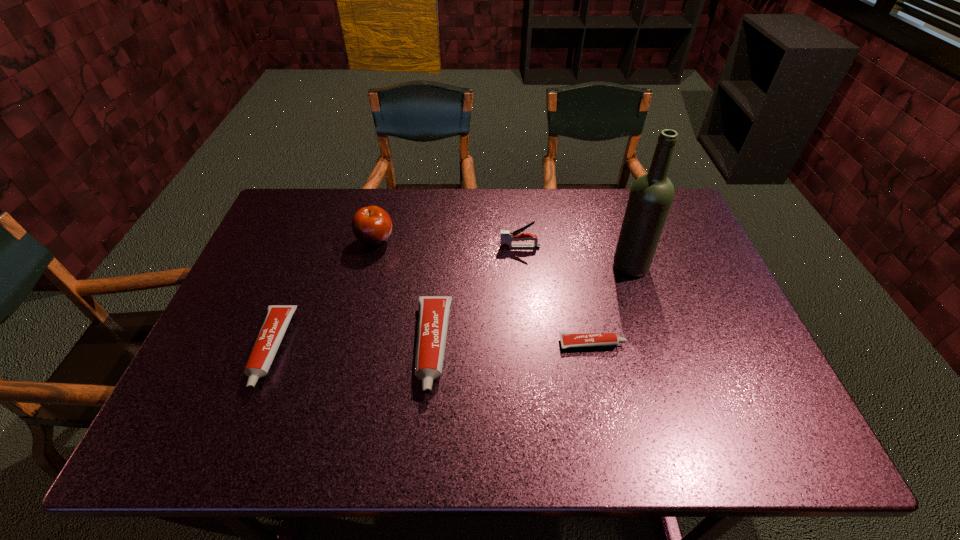
The image size is (960, 540). What are the coordinates of `free space at the far edge of the desktop` in the screenshot? It's located at (598, 212).

Where is `vacant space at the left edge of the desktop`? This screenshot has height=540, width=960. vacant space at the left edge of the desktop is located at coordinates (301, 247).

This screenshot has width=960, height=540. Find the location of `free spot at the right edge of the desktop`. free spot at the right edge of the desktop is located at coordinates (655, 259).

In the image, there is a desktop. Identify the location of vacant area at the near right corner. The height and width of the screenshot is (540, 960). (726, 376).

Where is `free space between the wine bottle and the fifth object from left to right`? This screenshot has width=960, height=540. free space between the wine bottle and the fifth object from left to right is located at coordinates (611, 305).

Where is `free space between the tallest object and the second tallest object`? This screenshot has width=960, height=540. free space between the tallest object and the second tallest object is located at coordinates (503, 254).

You are a GUI agent. You are given a task and a screenshot of the screen. Output one action in this format:
    pyautogui.click(x=<x>, y=<y>)
    Task: Click on the vacant region between the second object from left to right and the fourth shortest object
    The height and width of the screenshot is (540, 960).
    Given the screenshot: What is the action you would take?
    pyautogui.click(x=447, y=244)

You are a GUI agent. You are given a task and a screenshot of the screen. Output one action in this format:
    pyautogui.click(x=<x>, y=<y>)
    Task: Click on the vacant area that lies between the second toothpaste from left to right and the shortest object
    This screenshot has height=540, width=960.
    Given the screenshot: What is the action you would take?
    pyautogui.click(x=512, y=346)

You are a GUI agent. You are given a task and a screenshot of the screen. Output one action in this format:
    pyautogui.click(x=<x>, y=<y>)
    Task: Click on the free space between the fourth object from right to left and the rightmost object
    The image size is (960, 540).
    Given the screenshot: What is the action you would take?
    pyautogui.click(x=531, y=306)

What are the coordinates of `empty location between the tallest object and the second toothpaste from right to left` in the screenshot? It's located at (531, 306).